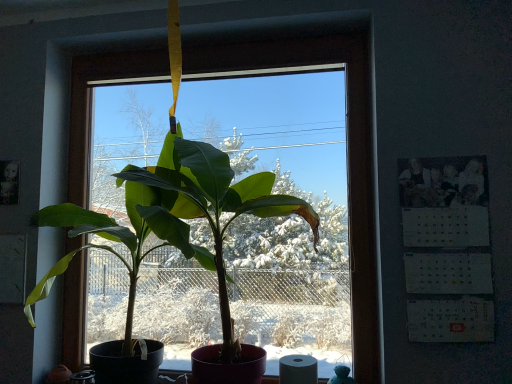
Based on the photo, measure the distance between point (450, 305) and camera.

The distance of point (450, 305) from camera is 1.54 meters.

The width and height of the screenshot is (512, 384). What are the coordinates of `white paper calendar at right` in the screenshot? It's located at 447,248.

In terms of width, does white matte toilet paper at lower center look wider or thinner when compared to white paper calendar at right?

In the image, white matte toilet paper at lower center appears to be wider than white paper calendar at right.

The width and height of the screenshot is (512, 384). I want to click on bulletin board above the white matte toilet paper at lower center (from the image's perspective), so tap(447, 248).

Which is farther from the camera, (304, 360) or (471, 204)?

Point (304, 360)

Considering the relative sizes of white matte toilet paper at lower center and white paper calendar at right in the image provided, is white matte toilet paper at lower center smaller than white paper calendar at right?

Correct, white matte toilet paper at lower center occupies less space than white paper calendar at right.

Considering the relative sizes of white paper calendar at right and white matte toilet paper at lower center in the image provided, is white paper calendar at right thinner than white matte toilet paper at lower center?

Yes, white paper calendar at right is thinner than white matte toilet paper at lower center.

Which is behind, point (411, 291) or point (295, 366)?

The point (295, 366) is more distant.

Is white paper calendar at right oriented towards white matte toilet paper at lower center?

No, white paper calendar at right is not oriented towards white matte toilet paper at lower center.

From the image's perspective, is white paper calendar at right located beneath white matte toilet paper at lower center?

No, from the image's perspective, white paper calendar at right is not beneath white matte toilet paper at lower center.

Is green matte plant at center wider or thinner than white paper calendar at right?

Clearly, green matte plant at center has more width compared to white paper calendar at right.

Does green matte plant at center have a smaller size compared to white paper calendar at right?

Incorrect, green matte plant at center is not smaller in size than white paper calendar at right.

Is point (298, 205) in front of point (477, 164)?

No, (298, 205) is further to viewer.

Considering the relative positions of green matte plant at center and white paper calendar at right in the image provided, is green matte plant at center to the left of white paper calendar at right from the viewer's perspective?

Yes.

Could you tell me if white paper calendar at right is turned towards green matte plant at center?

No.

Is white paper calendar at right positioned behind green matte plant at center?

Yes, white paper calendar at right is behind green matte plant at center.

Which point is more forward, (440, 206) or (211, 166)?

Point (440, 206)

Does point (301, 215) come in front of point (315, 381)?

That is False.

Is green matte plant at center positioned far away from white matte toilet paper at lower center?

green matte plant at center is near white matte toilet paper at lower center, not far away.

Find the location of a particular element. houseplant located above the white matte toilet paper at lower center (from a real-world perspective) is located at coordinates (174, 221).

Considering the relative sizes of white matte toilet paper at lower center and green matte plant at center in the image provided, is white matte toilet paper at lower center bigger than green matte plant at center?

Actually, white matte toilet paper at lower center might be smaller than green matte plant at center.

From the image's perspective, would you say white matte toilet paper at lower center is shown under green matte plant at center?

Yes.

Which object is positioned more to the right, white matte toilet paper at lower center or green matte plant at center?

Positioned to the right is white matte toilet paper at lower center.

Considering the positions of point (310, 379) and point (31, 323), is point (310, 379) closer or farther from the camera than point (31, 323)?

Point (310, 379) appears to be closer to the viewer than point (31, 323).

Locate an element on the screen. The width and height of the screenshot is (512, 384). bulletin board on the right of the white matte toilet paper at lower center is located at coordinates 447,248.

At what (x,y) coordinates should I click in order to perform the action: click on bulletin board above the white matte toilet paper at lower center (from the image's perspective). Please return your answer as a coordinate pair (x, y). The width and height of the screenshot is (512, 384). Looking at the image, I should click on (447, 248).

Based on their spatial positions, is green matte plant at center or white paper calendar at right further from white matte toilet paper at lower center?

green matte plant at center is positioned further to the anchor white matte toilet paper at lower center.

Estimate the real-world distances between objects in this image. Which object is closer to white paper calendar at right, white matte toilet paper at lower center or green matte plant at center?

white matte toilet paper at lower center is closer to white paper calendar at right.

Considering their positions, is white paper calendar at right positioned closer to white matte toilet paper at lower center than green matte plant at center?

white paper calendar at right lies closer to white matte toilet paper at lower center than the other object.

Looking at the image, which one is located closer to green matte plant at center, white matte toilet paper at lower center or white paper calendar at right?

white matte toilet paper at lower center is positioned closer to the anchor green matte plant at center.

Considering their positions, is green matte plant at center positioned further to white paper calendar at right than white matte toilet paper at lower center?

A: The object further to white paper calendar at right is green matte plant at center.

When comparing their distances from green matte plant at center, does white paper calendar at right or white matte toilet paper at lower center seem further?

Among the two, white paper calendar at right is located further to green matte plant at center.

Where is `toilet paper situated between green matte plant at center and white paper calendar at right from left to right`? Image resolution: width=512 pixels, height=384 pixels. toilet paper situated between green matte plant at center and white paper calendar at right from left to right is located at coordinates (298, 369).